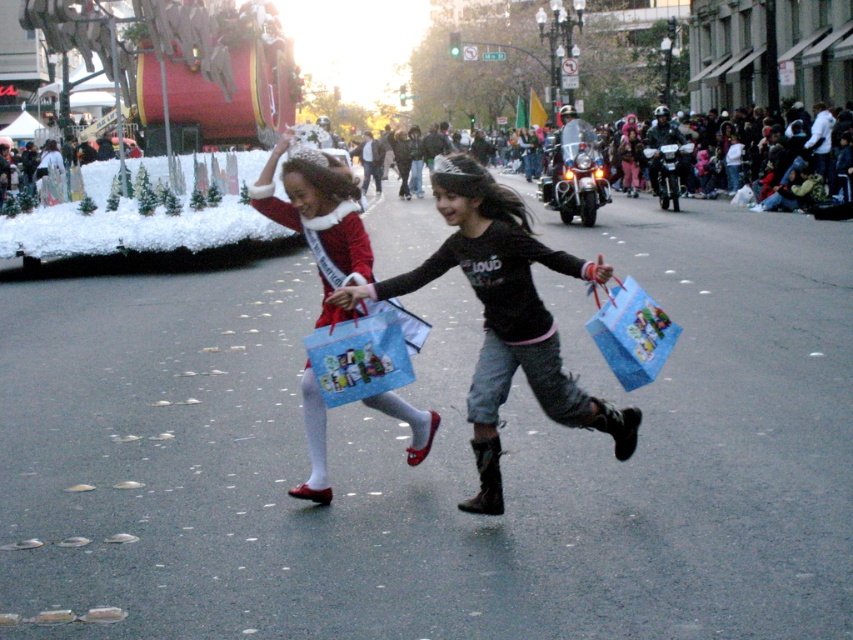
Which is above, matte black boots at center or matte red dress at center?

matte red dress at center is higher up.

Can you confirm if matte black boots at center is thinner than matte red dress at center?

No, matte black boots at center is not thinner than matte red dress at center.

Which is in front, point (566, 374) or point (306, 406)?

Point (566, 374)

You are a GUI agent. You are given a task and a screenshot of the screen. Output one action in this format:
    pyautogui.click(x=<x>, y=<y>)
    Task: Click on the matte black boots at center
    
    Given the screenshot: What is the action you would take?
    pyautogui.click(x=503, y=316)